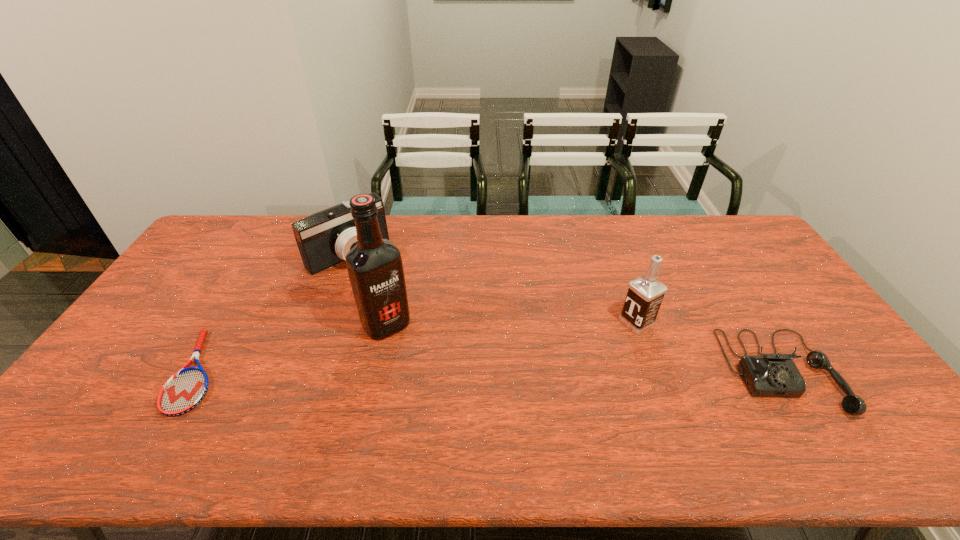
Where is `vacant space situated on the lens of the farthest object`? Image resolution: width=960 pixels, height=540 pixels. vacant space situated on the lens of the farthest object is located at coordinates (414, 314).

Identify the location of vacant region located 0.080m on the lens of the farthest object. (381, 282).

At what (x,y) coordinates should I click in order to perform the action: click on free spot located 0.280m on the lens of the farthest object. Please return your answer as a coordinate pair (x, y). The image size is (960, 540). Looking at the image, I should click on (416, 316).

This screenshot has width=960, height=540. What are the coordinates of `vacant space located 0.280m on the front-facing side of the liquor` in the screenshot? It's located at (455, 408).

Identify the location of free space located on the front-facing side of the liquor. The image size is (960, 540). (435, 383).

Where is `free space located 0.130m on the front-facing side of the liquor`? The image size is (960, 540). free space located 0.130m on the front-facing side of the liquor is located at coordinates (423, 368).

You are a GUI agent. You are given a task and a screenshot of the screen. Output one action in this format:
    pyautogui.click(x=<x>, y=<y>)
    Task: Click on the vacant space located 0.150m on the front label of the vodka
    The width and height of the screenshot is (960, 540).
    Given the screenshot: What is the action you would take?
    pyautogui.click(x=585, y=350)

The width and height of the screenshot is (960, 540). What are the coordinates of `free space located 0.160m on the front label of the vodka` in the screenshot? It's located at (582, 352).

I want to click on vacant space situated on the front label of the vodka, so click(x=577, y=355).

This screenshot has width=960, height=540. What are the coordinates of `object located in the far edge section of the desktop` in the screenshot? It's located at (324, 238).